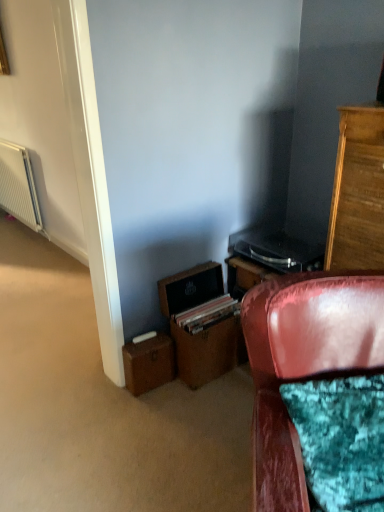
Locate an element on the screen. The width and height of the screenshot is (384, 512). free space above brown cardboard drawer at lower center (from a real-world perspective) is located at coordinates (207, 310).